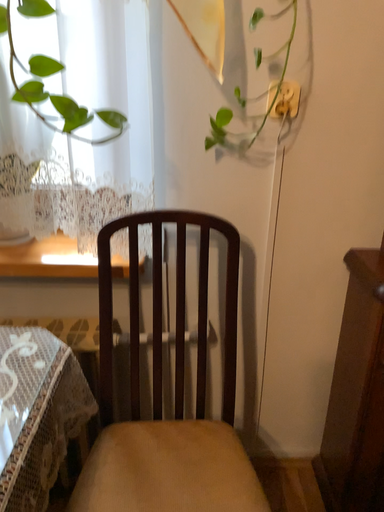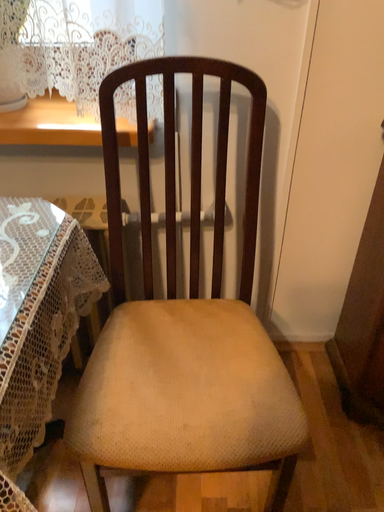
Question: How did the camera likely rotate when shooting the video?

Choices:
 (A) rotated downward
 (B) rotated upward

Answer: (A)